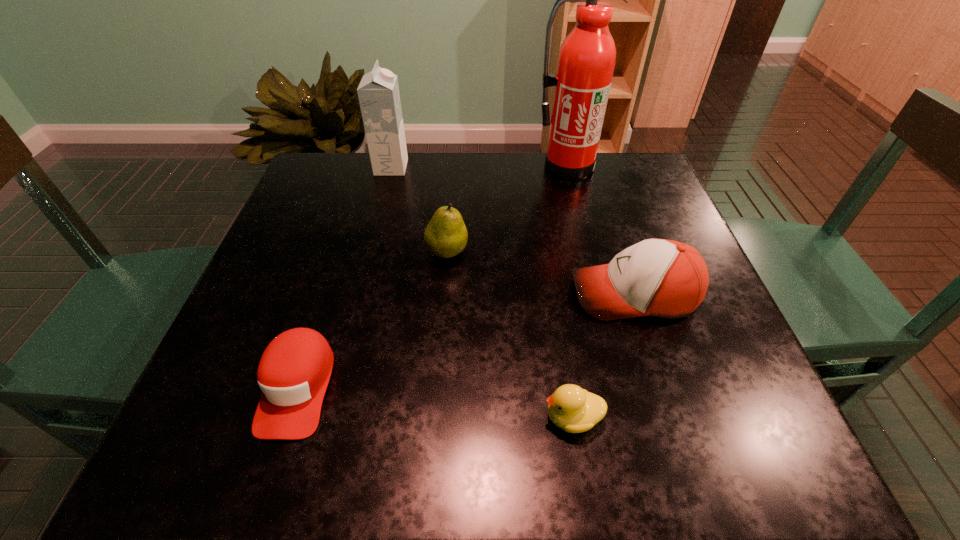
In the image, there is a desktop. Where is `vacant area at the right edge`? Image resolution: width=960 pixels, height=540 pixels. vacant area at the right edge is located at coordinates (614, 208).

In the image, there is a desktop. At what (x,y) coordinates should I click in order to perform the action: click on vacant space at the far left corner. Please return your answer as a coordinate pair (x, y). This screenshot has width=960, height=540. Looking at the image, I should click on [x=322, y=193].

Image resolution: width=960 pixels, height=540 pixels. In the image, there is a desktop. Find the location of `free space at the near left corner`. free space at the near left corner is located at coordinates (192, 429).

In the image, there is a desktop. What are the coordinates of `vacant area at the far right corner` in the screenshot? It's located at (636, 190).

This screenshot has width=960, height=540. Find the location of `vacant space that is in between the shorter baseball cap and the pear`. vacant space that is in between the shorter baseball cap and the pear is located at coordinates (372, 319).

Identify the location of empty space between the duckling and the tallest object. point(569,292).

Find the location of `unoccupied position between the tallest object and the right baseball cap`. unoccupied position between the tallest object and the right baseball cap is located at coordinates (600, 230).

Where is `unoccupied position between the duckling and the nearer baseball cap`? unoccupied position between the duckling and the nearer baseball cap is located at coordinates (435, 402).

Find the location of `free space between the second tallest object and the third object from left to right`. free space between the second tallest object and the third object from left to right is located at coordinates (420, 210).

Where is `vacant area that lies between the fourth farthest object and the carton`? The height and width of the screenshot is (540, 960). vacant area that lies between the fourth farthest object and the carton is located at coordinates [x=513, y=231].